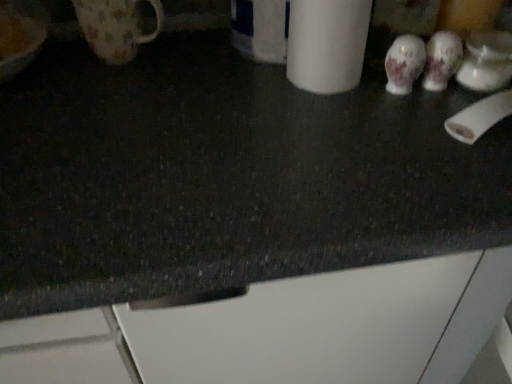
Question: Is white porcelain mug at upper right, the 2th mug from the left, at the left side of white matte paper towel at upper right?

Choices:
 (A) yes
 (B) no

Answer: (B)

Question: Can you confirm if white porcelain mug at upper right, the 2th mug from the left, is shorter than white matte paper towel at upper right?

Choices:
 (A) no
 (B) yes

Answer: (B)

Question: Is white porcelain mug at upper right, the 2th mug from the left, turned away from white matte paper towel at upper right?

Choices:
 (A) no
 (B) yes

Answer: (A)

Question: Is white porcelain mug at upper right, arranged as the first mug when viewed from the right, positioned in front of white matte paper towel at upper right?

Choices:
 (A) yes
 (B) no

Answer: (B)

Question: From the image's perspective, would you say white porcelain mug at upper right, arranged as the first mug when viewed from the right, is positioned over white matte paper towel at upper right?

Choices:
 (A) yes
 (B) no

Answer: (B)

Question: Considering the positions of white matte toilet paper at right and floral ceramic mug at upper left, the second mug from the right, in the image, is white matte toilet paper at right bigger or smaller than floral ceramic mug at upper left, the second mug from the right,?

Choices:
 (A) big
 (B) small

Answer: (B)

Question: Considering the positions of white matte toilet paper at right and floral ceramic mug at upper left, the second mug from the right, in the image, is white matte toilet paper at right taller or shorter than floral ceramic mug at upper left, the second mug from the right,?

Choices:
 (A) tall
 (B) short

Answer: (B)

Question: Is white matte toilet paper at right to the left or to the right of floral ceramic mug at upper left, the first mug when ordered from left to right, in the image?

Choices:
 (A) right
 (B) left

Answer: (A)

Question: Do you think white matte toilet paper at right is within floral ceramic mug at upper left, the first mug when ordered from left to right, or outside of it?

Choices:
 (A) outside
 (B) inside

Answer: (A)

Question: Considering the positions of floral ceramic mug at upper left, the first mug when ordered from left to right, and white matte paper towel at upper right in the image, is floral ceramic mug at upper left, the first mug when ordered from left to right, bigger or smaller than white matte paper towel at upper right?

Choices:
 (A) small
 (B) big

Answer: (A)

Question: Does point (116, 57) appear closer or farther from the camera than point (357, 66)?

Choices:
 (A) closer
 (B) farther

Answer: (B)

Question: Is floral ceramic mug at upper left, the second mug from the right, taller or shorter than white matte paper towel at upper right?

Choices:
 (A) tall
 (B) short

Answer: (B)

Question: From the image's perspective, is floral ceramic mug at upper left, the second mug from the right, located above or below white matte paper towel at upper right?

Choices:
 (A) above
 (B) below

Answer: (A)

Question: In terms of width, does white matte paper towel at upper right look wider or thinner when compared to white matte toilet paper at right?

Choices:
 (A) wide
 (B) thin

Answer: (A)

Question: Is white matte paper towel at upper right bigger or smaller than white matte toilet paper at right?

Choices:
 (A) big
 (B) small

Answer: (A)